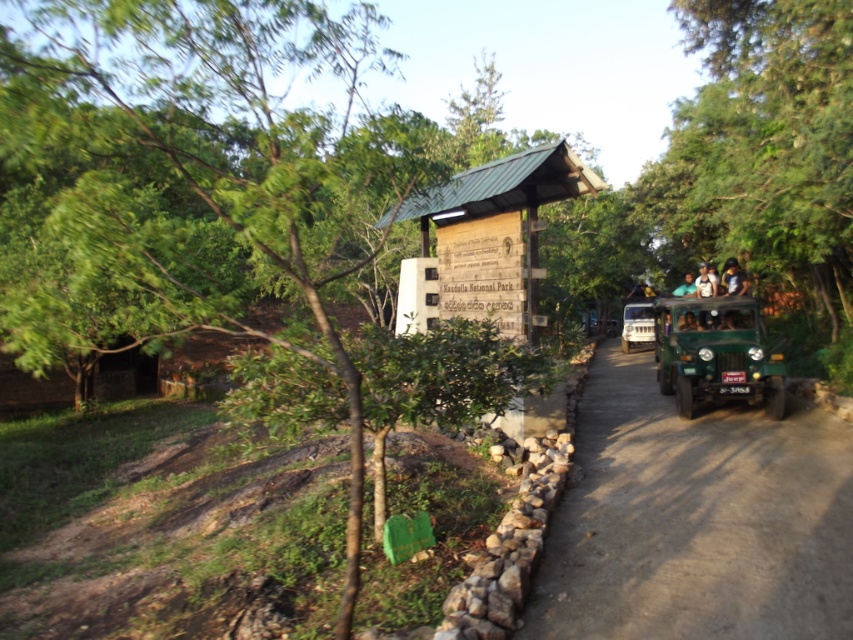
Is point (763, 596) closer to camera compared to point (712, 296)?

Yes.

Find the location of a particular element. Image resolution: width=853 pixels, height=640 pixels. dirt road at center is located at coordinates (695, 518).

Is wooden sign at center thinner than blurred plastic head at upper center?

Correct, wooden sign at center's width is less than blurred plastic head at upper center's.

Consider the image. Is wooden sign at center shorter than blurred plastic head at upper center?

Incorrect, wooden sign at center's height does not fall short of blurred plastic head at upper center's.

Does point (560, 196) come farther from viewer compared to point (689, 289)?

No, (560, 196) is in front of (689, 289).

Where is `wooden sign at center`? The height and width of the screenshot is (640, 853). wooden sign at center is located at coordinates (495, 236).

From the picture: Is green leafy tree at center bigger than blurred plastic head at upper center?

Yes.

Locate an element on the screen. green leafy tree at center is located at coordinates (201, 180).

Identify the location of green leafy tree at center. The width and height of the screenshot is (853, 640). (201, 180).